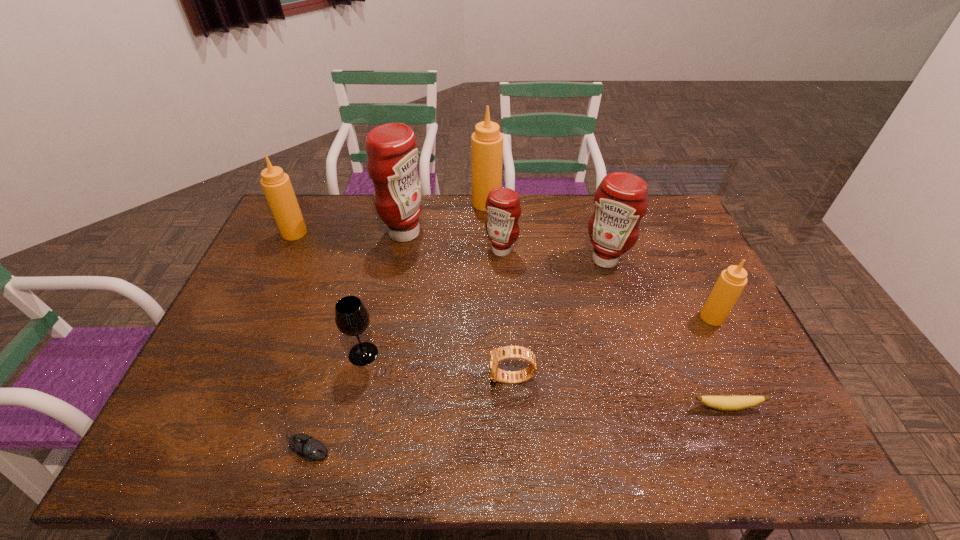
Locate an element on the screen. The image size is (960, 540). the farthest object is located at coordinates (487, 141).

I want to click on the second tan condiment from left to right, so click(487, 141).

You are a GUI agent. You are given a task and a screenshot of the screen. Output one action in this format:
    pyautogui.click(x=<x>, y=<y>)
    Task: Click on the second condiment from left to right
    The image size is (960, 540).
    Given the screenshot: What is the action you would take?
    pyautogui.click(x=392, y=156)

At what (x,y) coordinates should I click in order to perform the action: click on the leftmost red condiment. Please return your answer as a coordinate pair (x, y). Looking at the image, I should click on (392, 156).

Find the location of a particular element. This screenshot has width=960, height=540. the second smallest red condiment is located at coordinates (621, 200).

Locate an element on the screen. Image resolution: width=960 pixels, height=540 pixels. the rightmost red condiment is located at coordinates (621, 200).

Image resolution: width=960 pixels, height=540 pixels. I want to click on the leftmost condiment, so click(277, 187).

In order to click on the leftmost object in this screenshot , I will do `click(277, 187)`.

This screenshot has height=540, width=960. I want to click on the fifth nearest object, so click(731, 282).

The width and height of the screenshot is (960, 540). What are the coordinates of `the smallest tan condiment` in the screenshot? It's located at (731, 282).